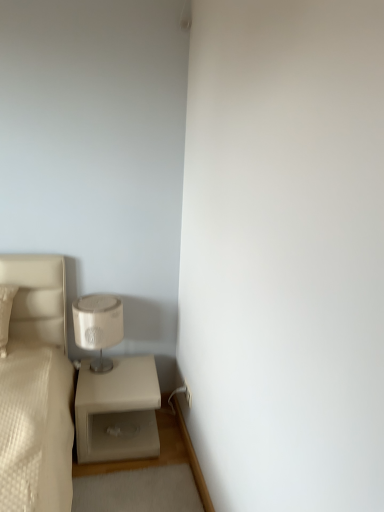
The height and width of the screenshot is (512, 384). Describe the element at coordinates (98, 326) in the screenshot. I see `matte beige lampshade at lower left` at that location.

This screenshot has width=384, height=512. I want to click on matte beige lampshade at lower left, so 98,326.

What is the approximate height of beige matte nightstand at lower left?

The height of beige matte nightstand at lower left is 37.36 centimeters.

Measure the distance between beige matte nightstand at lower left and camera.

6.62 feet.

The width and height of the screenshot is (384, 512). Describe the element at coordinates (117, 411) in the screenshot. I see `beige matte nightstand at lower left` at that location.

Identify the location of beige matte nightstand at lower left. (117, 411).

Where is `matte beige lampshade at lower left`? The height and width of the screenshot is (512, 384). matte beige lampshade at lower left is located at coordinates (98, 326).

Which is more to the right, beige matte nightstand at lower left or matte beige lampshade at lower left?

Positioned to the right is beige matte nightstand at lower left.

Which object is closer to the camera, beige matte nightstand at lower left or matte beige lampshade at lower left?

beige matte nightstand at lower left is more forward.

Is point (152, 442) positioned behind point (113, 329)?

No, it is in front of (113, 329).

From the image's perspective, is beige matte nightstand at lower left on top of matte beige lampshade at lower left?

Incorrect, from the image's perspective, beige matte nightstand at lower left is lower than matte beige lampshade at lower left.

Consider the image. From a real-world perspective, is beige matte nightstand at lower left positioned above or below matte beige lampshade at lower left?

Clearly, from a real-world perspective, beige matte nightstand at lower left is below matte beige lampshade at lower left.

Considering the sizes of objects beige matte nightstand at lower left and matte beige lampshade at lower left in the image provided, who is thinner, beige matte nightstand at lower left or matte beige lampshade at lower left?

matte beige lampshade at lower left.

Which of these two, beige matte nightstand at lower left or matte beige lampshade at lower left, stands shorter?

beige matte nightstand at lower left is shorter.

Is beige matte nightstand at lower left smaller than matte beige lampshade at lower left?

No.

Would you say beige matte nightstand at lower left is outside matte beige lampshade at lower left?

Indeed, beige matte nightstand at lower left is completely outside matte beige lampshade at lower left.

Are beige matte nightstand at lower left and matte beige lampshade at lower left located far from each other?

No, there isn't a large distance between beige matte nightstand at lower left and matte beige lampshade at lower left.

Is beige matte nightstand at lower left looking in the opposite direction of matte beige lampshade at lower left?

No, beige matte nightstand at lower left is not facing away from matte beige lampshade at lower left.

This screenshot has height=512, width=384. I want to click on nightstand below the matte beige lampshade at lower left (from the image's perspective), so click(117, 411).

Between matte beige lampshade at lower left and beige matte nightstand at lower left, which one appears on the right side from the viewer's perspective?

beige matte nightstand at lower left is more to the right.

Is matte beige lampshade at lower left in front of beige matte nightstand at lower left?

No, matte beige lampshade at lower left is behind beige matte nightstand at lower left.

Between point (119, 320) and point (103, 405), which one is positioned behind?

The point (119, 320) is farther from the camera.

From the image's perspective, does matte beige lampshade at lower left appear higher than beige matte nightstand at lower left?

Yes, from the image's perspective, matte beige lampshade at lower left is on top of beige matte nightstand at lower left.

From a real-world perspective, is matte beige lampshade at lower left below beige matte nightstand at lower left?

Actually, matte beige lampshade at lower left is physically above beige matte nightstand at lower left in the real world.

Considering the relative sizes of matte beige lampshade at lower left and beige matte nightstand at lower left in the image provided, is matte beige lampshade at lower left wider than beige matte nightstand at lower left?

Incorrect, the width of matte beige lampshade at lower left does not surpass that of beige matte nightstand at lower left.

Which of these two, matte beige lampshade at lower left or beige matte nightstand at lower left, stands shorter?

With less height is beige matte nightstand at lower left.

Based on the photo, considering the relative sizes of matte beige lampshade at lower left and beige matte nightstand at lower left in the image provided, is matte beige lampshade at lower left smaller than beige matte nightstand at lower left?

Indeed, matte beige lampshade at lower left has a smaller size compared to beige matte nightstand at lower left.

Is matte beige lampshade at lower left located outside beige matte nightstand at lower left?

Absolutely, matte beige lampshade at lower left is external to beige matte nightstand at lower left.

Are matte beige lampshade at lower left and beige matte nightstand at lower left located far from each other?

matte beige lampshade at lower left is actually quite close to beige matte nightstand at lower left.

Is matte beige lampshade at lower left facing towards beige matte nightstand at lower left?

No, matte beige lampshade at lower left is not aimed at beige matte nightstand at lower left.

From the picture: Can you tell me how much matte beige lampshade at lower left and beige matte nightstand at lower left differ in facing direction?

The angular difference between matte beige lampshade at lower left and beige matte nightstand at lower left is 4.05 degrees.

Where is `table lamp on the left of beige matte nightstand at lower left`? The width and height of the screenshot is (384, 512). table lamp on the left of beige matte nightstand at lower left is located at coordinates click(98, 326).

Image resolution: width=384 pixels, height=512 pixels. Identify the location of nightstand that appears below the matte beige lampshade at lower left (from a real-world perspective). (117, 411).

The image size is (384, 512). What are the coordinates of `table lamp that appears above the beige matte nightstand at lower left (from a real-world perspective)` in the screenshot? It's located at (98, 326).